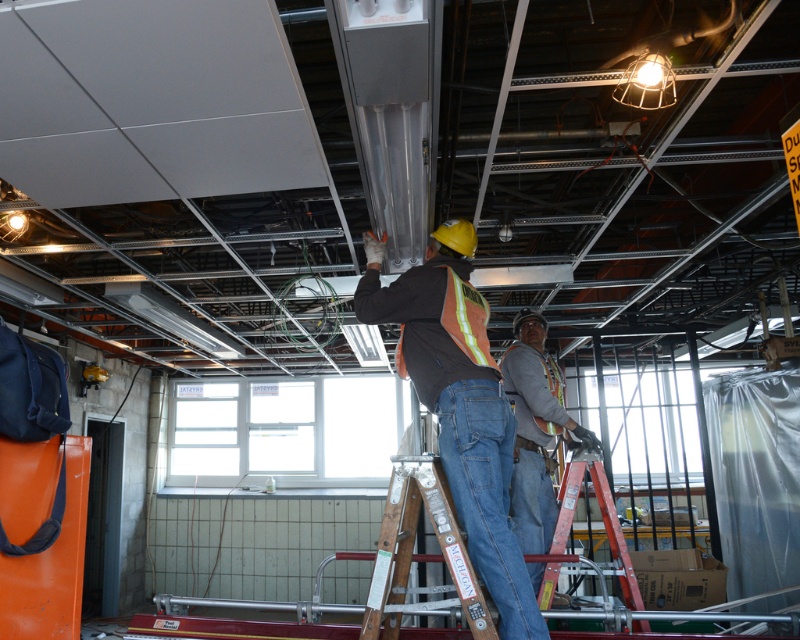
You are a safety inspector checking the workspace. The orange safety vest at center and the metallic red ladder at center are both in the center of the image. According to safety regulations, the minimum safe distance between a ladder and any equipment or objects should be at least 12 inches. Is there a safety violation present here?

The distance between the orange safety vest at center and the metallic red ladder at center is 10.12 inches, which is less than the required 12 inches. This indicates a safety violation as the ladder is too close to the equipment or objects represented by the safety vest.